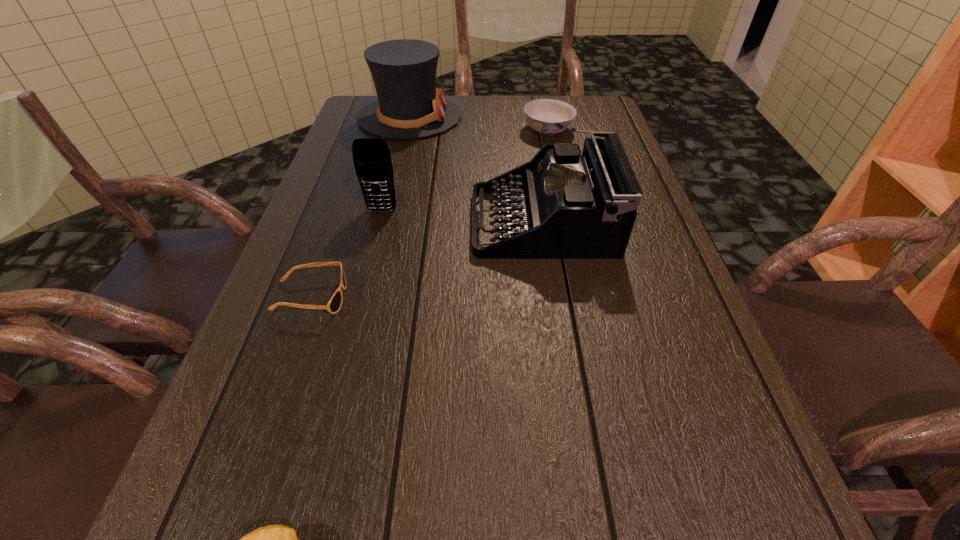
Identify the location of free space located 0.100m on the typing side of the typewriter. This screenshot has height=540, width=960. (428, 221).

Locate an element on the screen. This screenshot has width=960, height=540. free space located on the front of the bowl is located at coordinates (562, 193).

I want to click on vacant space located on the front-facing side of the second nearest object, so click(x=478, y=298).

Identify the location of dress hat at the far edge. This screenshot has width=960, height=540. (409, 106).

In order to click on bowl that is at the far edge in this screenshot , I will do `click(548, 117)`.

Locate an element on the screen. dress hat at the left edge is located at coordinates (409, 106).

The image size is (960, 540). Identify the location of cellular telephone positioned at the left edge. [x=371, y=156].

Identify the location of sunglasses that is at the left edge. (333, 306).

At what (x,y) coordinates should I click in order to perform the action: click on typewriter present at the right edge. Please return your answer as a coordinate pair (x, y). Looking at the image, I should click on (570, 206).

Find the location of a particular element. The height and width of the screenshot is (540, 960). bowl present at the right edge is located at coordinates (548, 117).